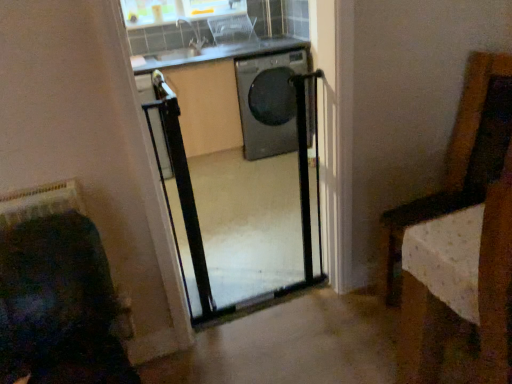
Question: Should I look upward or downward to see black glossy washing machine at center?

Choices:
 (A) down
 (B) up

Answer: (B)

Question: Considering the relative positions of black glossy washing machine at center and clear plastic basket at upper center in the image provided, is black glossy washing machine at center to the right of clear plastic basket at upper center from the viewer's perspective?

Choices:
 (A) yes
 (B) no

Answer: (A)

Question: Is clear plastic basket at upper center at the back of black glossy washing machine at center?

Choices:
 (A) yes
 (B) no

Answer: (B)

Question: Could you tell me if black glossy washing machine at center is turned towards clear plastic basket at upper center?

Choices:
 (A) no
 (B) yes

Answer: (A)

Question: From the image's perspective, does black glossy washing machine at center appear lower than clear plastic basket at upper center?

Choices:
 (A) yes
 (B) no

Answer: (A)

Question: Can you confirm if black glossy washing machine at center is wider than clear plastic basket at upper center?

Choices:
 (A) yes
 (B) no

Answer: (A)

Question: Is the position of black glossy washing machine at center more distant than that of clear plastic basket at upper center?

Choices:
 (A) no
 (B) yes

Answer: (A)

Question: Can you confirm if clear plastic basket at upper center is wider than black glossy washing machine at center?

Choices:
 (A) yes
 (B) no

Answer: (B)

Question: From the image's perspective, is clear plastic basket at upper center beneath black glossy washing machine at center?

Choices:
 (A) no
 (B) yes

Answer: (A)

Question: Does clear plastic basket at upper center have a lesser width compared to black glossy washing machine at center?

Choices:
 (A) no
 (B) yes

Answer: (B)

Question: Is clear plastic basket at upper center located outside black glossy washing machine at center?

Choices:
 (A) yes
 (B) no

Answer: (A)

Question: Are clear plastic basket at upper center and black glossy washing machine at center beside each other?

Choices:
 (A) yes
 (B) no

Answer: (B)

Question: Is clear plastic basket at upper center facing towards black glossy washing machine at center?

Choices:
 (A) yes
 (B) no

Answer: (B)

Question: Considering the relative positions of black metal screen door at center and black glossy washing machine at center in the image provided, is black metal screen door at center behind black glossy washing machine at center?

Choices:
 (A) no
 (B) yes

Answer: (A)